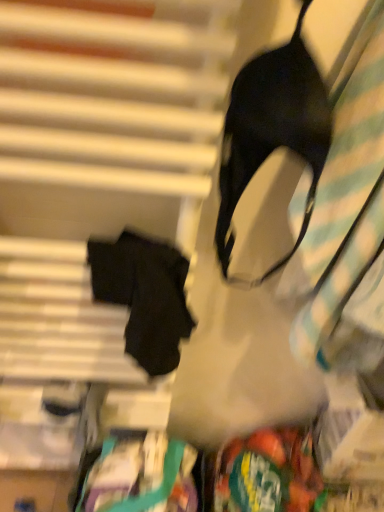
Question: Is black matte fabric robe at left far away from black matte bra at upper right?

Choices:
 (A) yes
 (B) no

Answer: (B)

Question: Can you confirm if black matte fabric robe at left is bigger than black matte bra at upper right?

Choices:
 (A) no
 (B) yes

Answer: (A)

Question: Does black matte fabric robe at left appear on the left side of black matte bra at upper right?

Choices:
 (A) yes
 (B) no

Answer: (A)

Question: Does black matte fabric robe at left have a smaller size compared to black matte bra at upper right?

Choices:
 (A) yes
 (B) no

Answer: (A)

Question: Does black matte fabric robe at left have a lesser width compared to black matte bra at upper right?

Choices:
 (A) yes
 (B) no

Answer: (A)

Question: From the image's perspective, is black matte fabric robe at left located above black matte bra at upper right?

Choices:
 (A) yes
 (B) no

Answer: (B)

Question: Is black matte fabric robe at left positioned with its back to green plastic bag at lower right?

Choices:
 (A) no
 (B) yes

Answer: (A)

Question: Can you confirm if black matte fabric robe at left is positioned to the right of green plastic bag at lower right?

Choices:
 (A) no
 (B) yes

Answer: (A)

Question: Is black matte fabric robe at left positioned beyond the bounds of green plastic bag at lower right?

Choices:
 (A) yes
 (B) no

Answer: (A)

Question: From a real-world perspective, does black matte fabric robe at left sit lower than green plastic bag at lower right?

Choices:
 (A) yes
 (B) no

Answer: (B)

Question: Can you confirm if black matte fabric robe at left is smaller than green plastic bag at lower right?

Choices:
 (A) yes
 (B) no

Answer: (A)

Question: Considering the relative positions of black matte fabric robe at left and green plastic bag at lower right in the image provided, is black matte fabric robe at left behind green plastic bag at lower right?

Choices:
 (A) yes
 (B) no

Answer: (B)

Question: Can you confirm if black matte bra at upper right is positioned to the left of green plastic bag at lower right?

Choices:
 (A) no
 (B) yes

Answer: (B)